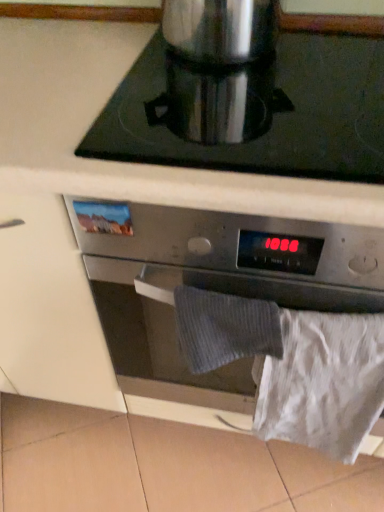
Question: Is satin silver oven at center positioned behind white paper at lower right?

Choices:
 (A) no
 (B) yes

Answer: (A)

Question: Is satin silver oven at center positioned with its back to white paper at lower right?

Choices:
 (A) yes
 (B) no

Answer: (B)

Question: Is satin silver oven at center completely or partially outside of white paper at lower right?

Choices:
 (A) no
 (B) yes

Answer: (B)

Question: Is satin silver oven at center shorter than white paper at lower right?

Choices:
 (A) yes
 (B) no

Answer: (B)

Question: Considering the relative positions of satin silver oven at center and white paper at lower right in the image provided, is satin silver oven at center to the right of white paper at lower right from the viewer's perspective?

Choices:
 (A) no
 (B) yes

Answer: (A)

Question: From a real-world perspective, is satin silver oven at center located beneath white paper at lower right?

Choices:
 (A) yes
 (B) no

Answer: (B)

Question: From the image's perspective, does satin silver oven at center appear lower than satin silver coffee pot at upper center?

Choices:
 (A) yes
 (B) no

Answer: (A)

Question: From the image's perspective, is satin silver oven at center above satin silver coffee pot at upper center?

Choices:
 (A) yes
 (B) no

Answer: (B)

Question: Can you confirm if satin silver oven at center is smaller than satin silver coffee pot at upper center?

Choices:
 (A) no
 (B) yes

Answer: (A)

Question: Can you confirm if satin silver oven at center is shorter than satin silver coffee pot at upper center?

Choices:
 (A) yes
 (B) no

Answer: (B)

Question: From a real-world perspective, is satin silver oven at center on satin silver coffee pot at upper center?

Choices:
 (A) yes
 (B) no

Answer: (B)

Question: Considering the relative sizes of satin silver oven at center and satin silver coffee pot at upper center in the image provided, is satin silver oven at center bigger than satin silver coffee pot at upper center?

Choices:
 (A) yes
 (B) no

Answer: (A)

Question: From the image's perspective, is satin silver oven at center over silver metallic pot at upper center?

Choices:
 (A) yes
 (B) no

Answer: (B)